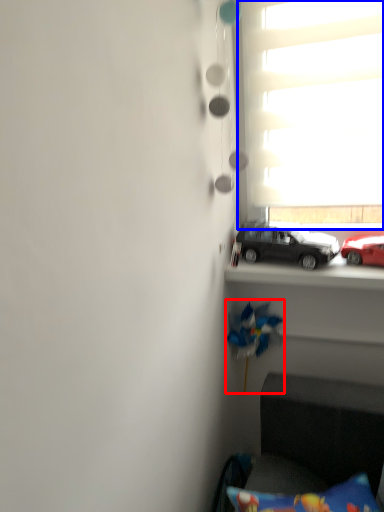
Question: Among these objects, which one is nearest to the camera, toy (highlighted by a red box) or window (highlighted by a blue box)?

Choices:
 (A) toy
 (B) window

Answer: (B)